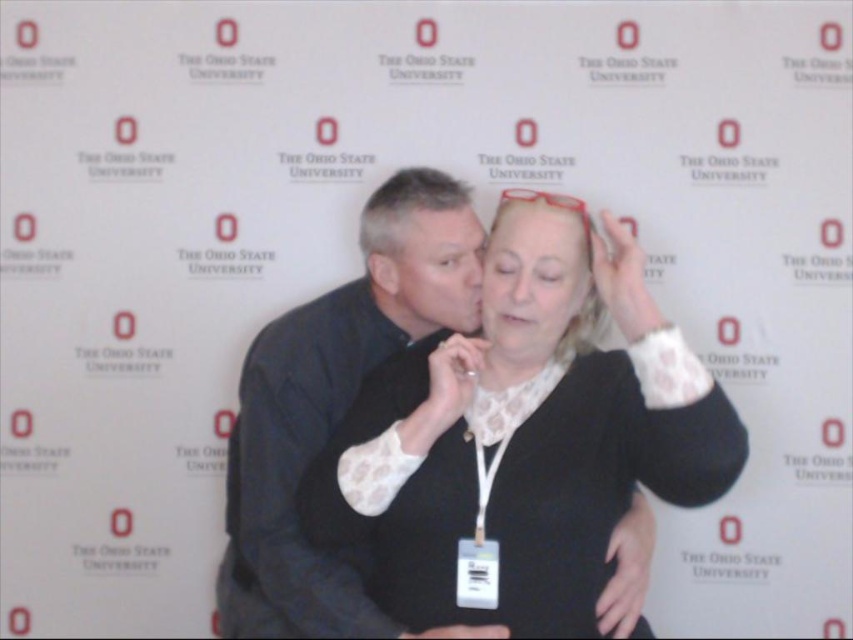
Which is more to the left, matte black sweater at center or smooth skin face at center?

matte black sweater at center is more to the left.

Does matte black sweater at center have a lesser width compared to smooth skin face at center?

In fact, matte black sweater at center might be wider than smooth skin face at center.

Is point (503, 579) closer to camera compared to point (573, 262)?

Yes, it is.

The height and width of the screenshot is (640, 853). What are the coordinates of `matte black sweater at center` in the screenshot? It's located at (521, 440).

Is smooth skin face at center smaller than matte black forehead at center?

Incorrect, smooth skin face at center is not smaller in size than matte black forehead at center.

Does smooth skin face at center appear on the right side of matte black forehead at center?

Indeed, smooth skin face at center is positioned on the right side of matte black forehead at center.

Locate an element on the screen. The height and width of the screenshot is (640, 853). smooth skin face at center is located at coordinates (543, 244).

The image size is (853, 640). Identify the location of smooth skin face at center. (543, 244).

Who is more distant from viewer, (444, 273) or (577, 228)?

The point (444, 273) is more distant.

Is point (410, 328) farther from viewer compared to point (582, 230)?

Yes, it is behind point (582, 230).

The width and height of the screenshot is (853, 640). I want to click on matte black face at center, so click(434, 272).